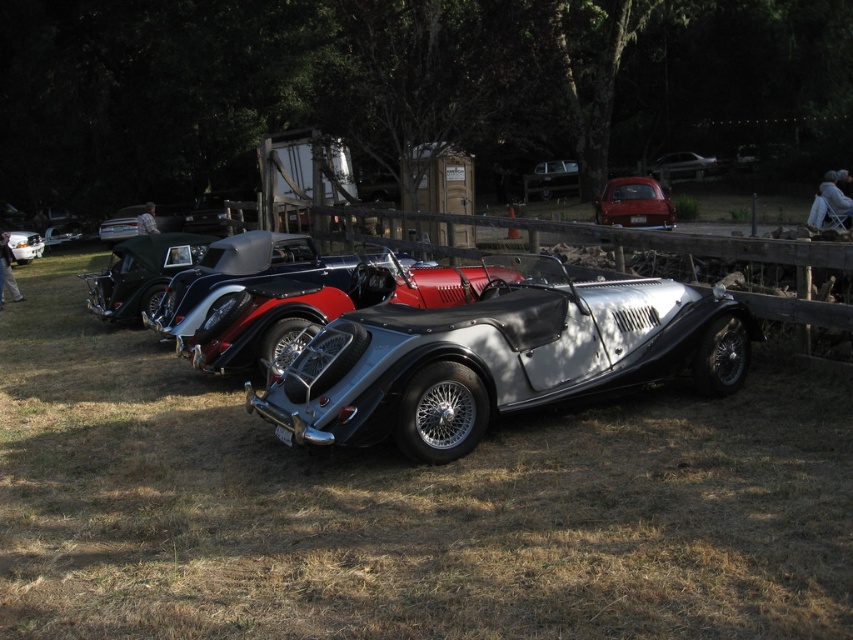
Question: Which of the following is the farthest from the observer?

Choices:
 (A) (675, 177)
 (B) (659, 362)

Answer: (A)

Question: Estimate the real-world distances between objects in this image. Which object is farther from the matte black car at center?

Choices:
 (A) metallic red car at center
 (B) metallic silver convertible at upper right

Answer: (B)

Question: Based on their relative distances, which object is farther from the matte black car at center?

Choices:
 (A) silver metallic convertible at center
 (B) metallic silver convertible at upper right
 (C) metallic red car at center

Answer: (B)

Question: Can you confirm if silver metallic convertible at center is positioned below metallic red car at center?

Choices:
 (A) yes
 (B) no

Answer: (A)

Question: Does metallic red car at center appear under metallic silver convertible at upper right?

Choices:
 (A) yes
 (B) no

Answer: (A)

Question: Does metallic red car at center have a lesser width compared to matte black car at center?

Choices:
 (A) no
 (B) yes

Answer: (A)